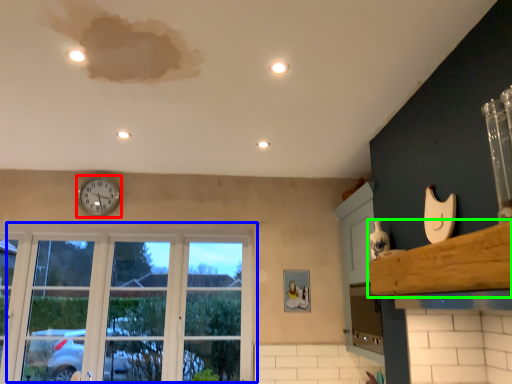
Question: Which is farther away from clock (highlighted by a red box)? window (highlighted by a blue box) or window sill (highlighted by a green box)?

Choices:
 (A) window
 (B) window sill

Answer: (B)